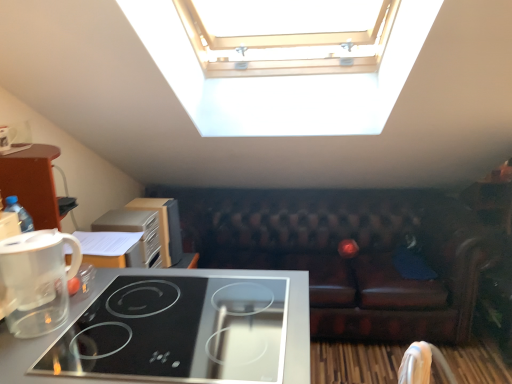
You are a GUI agent. You are given a task and a screenshot of the screen. Output one action in this format:
    pyautogui.click(x=<x>, y=<y>)
    Task: Click on the free space above satin silver toaster at upper left, the 2th appliance viewed from the back (from a real-world perspective)
    The image size is (512, 384).
    Given the screenshot: What is the action you would take?
    pyautogui.click(x=121, y=216)